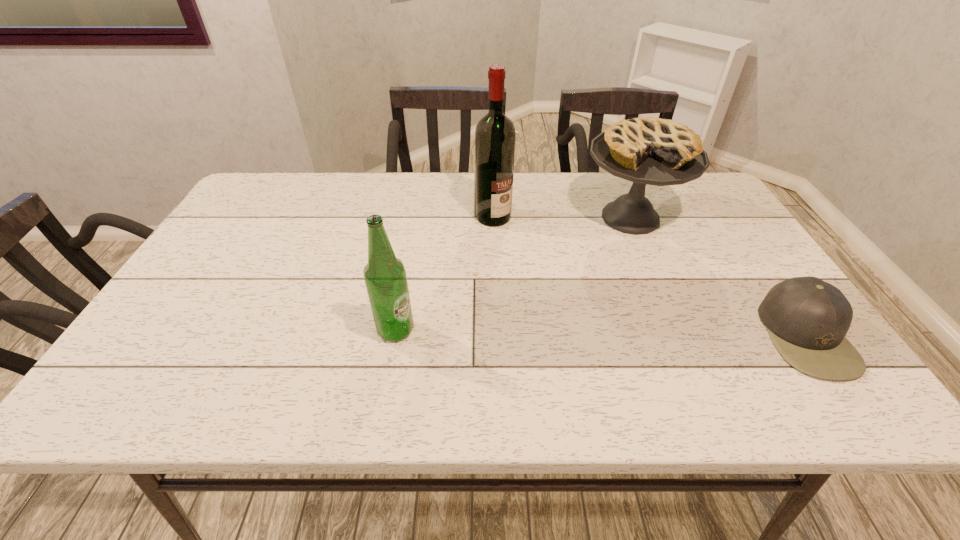
You are a GUI agent. You are given a task and a screenshot of the screen. Output one action in this format:
    pyautogui.click(x=<x>, y=<y>)
    Task: Click on the vacant region between the pie and the shortest object
    Image resolution: width=960 pixels, height=540 pixels.
    Given the screenshot: What is the action you would take?
    pyautogui.click(x=718, y=276)

The image size is (960, 540). Find the location of `empty location between the leftmost object and the rightmost object`. empty location between the leftmost object and the rightmost object is located at coordinates (601, 333).

Where is `free space that is in between the pie and the rightmost object`? This screenshot has width=960, height=540. free space that is in between the pie and the rightmost object is located at coordinates (718, 276).

Where is `free space that is in between the second object from right to left and the shortest object`? free space that is in between the second object from right to left and the shortest object is located at coordinates click(x=718, y=276).

At what (x,y) coordinates should I click in order to perform the action: click on vacant area between the rightmost object and the leftmost object. Please return your answer as a coordinate pair (x, y). This screenshot has height=540, width=960. Looking at the image, I should click on (601, 333).

Locate an element on the screen. Image resolution: width=960 pixels, height=540 pixels. free area in between the rightmost object and the alcohol is located at coordinates (650, 276).

The height and width of the screenshot is (540, 960). Identify the location of empty space that is in between the rightmost object and the second object from left to right. (650, 276).

I want to click on vacant space that's between the cap and the pie, so click(x=718, y=276).

What are the coordinates of `vacant area that lies between the shortest object and the third object from left to right` in the screenshot? It's located at (718, 276).

What are the coordinates of `empty space that is in between the rightmost object and the alcohol` in the screenshot? It's located at (650, 276).